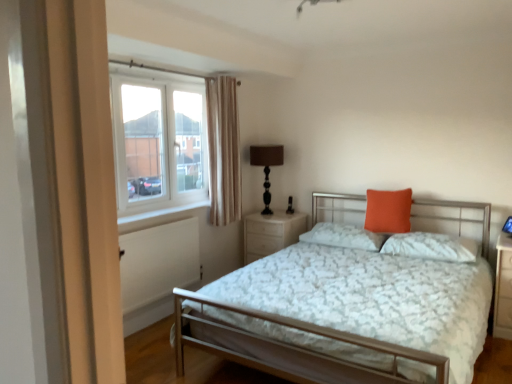
Question: Is white textured pillow at center, which is counted as the first pillow, starting from the right, not near white painted wood at lower left?

Choices:
 (A) yes
 (B) no

Answer: (A)

Question: Is white textured pillow at center, marked as the 3th pillow in a left-to-right arrangement, positioned with its back to white painted wood at lower left?

Choices:
 (A) yes
 (B) no

Answer: (B)

Question: Would you say white textured pillow at center, marked as the 3th pillow in a left-to-right arrangement, contains white painted wood at lower left?

Choices:
 (A) yes
 (B) no

Answer: (B)

Question: From the image's perspective, is white textured pillow at center, which is counted as the first pillow, starting from the right, above white painted wood at lower left?

Choices:
 (A) no
 (B) yes

Answer: (A)

Question: Can you confirm if white textured pillow at center, marked as the 3th pillow in a left-to-right arrangement, is wider than white painted wood at lower left?

Choices:
 (A) no
 (B) yes

Answer: (B)

Question: In the image, is white painted wood at lower left on the left side or the right side of pine wood nightstand at center?

Choices:
 (A) right
 (B) left

Answer: (B)

Question: Considering the positions of white painted wood at lower left and pine wood nightstand at center in the image, is white painted wood at lower left bigger or smaller than pine wood nightstand at center?

Choices:
 (A) big
 (B) small

Answer: (B)

Question: In terms of height, does white painted wood at lower left look taller or shorter compared to pine wood nightstand at center?

Choices:
 (A) tall
 (B) short

Answer: (B)

Question: In the image, is white painted wood at lower left positioned in front of or behind pine wood nightstand at center?

Choices:
 (A) front
 (B) behind

Answer: (A)

Question: In the image, is pine wood nightstand at center positioned in front of or behind brown fabric-covered lamp at upper right?

Choices:
 (A) front
 (B) behind

Answer: (A)

Question: In terms of height, does pine wood nightstand at center look taller or shorter compared to brown fabric-covered lamp at upper right?

Choices:
 (A) short
 (B) tall

Answer: (A)

Question: Which is correct: pine wood nightstand at center is inside brown fabric-covered lamp at upper right, or outside of it?

Choices:
 (A) outside
 (B) inside

Answer: (A)

Question: In the image, is pine wood nightstand at center on the left side or the right side of brown fabric-covered lamp at upper right?

Choices:
 (A) left
 (B) right

Answer: (B)

Question: From a real-world perspective, is orange matte pillow at upper right, the second pillow when ordered from right to left, above or below brown fabric-covered lamp at upper right?

Choices:
 (A) above
 (B) below

Answer: (B)

Question: In the image, is orange matte pillow at upper right, which is the 2th pillow in left-to-right order, on the left side or the right side of brown fabric-covered lamp at upper right?

Choices:
 (A) left
 (B) right

Answer: (B)